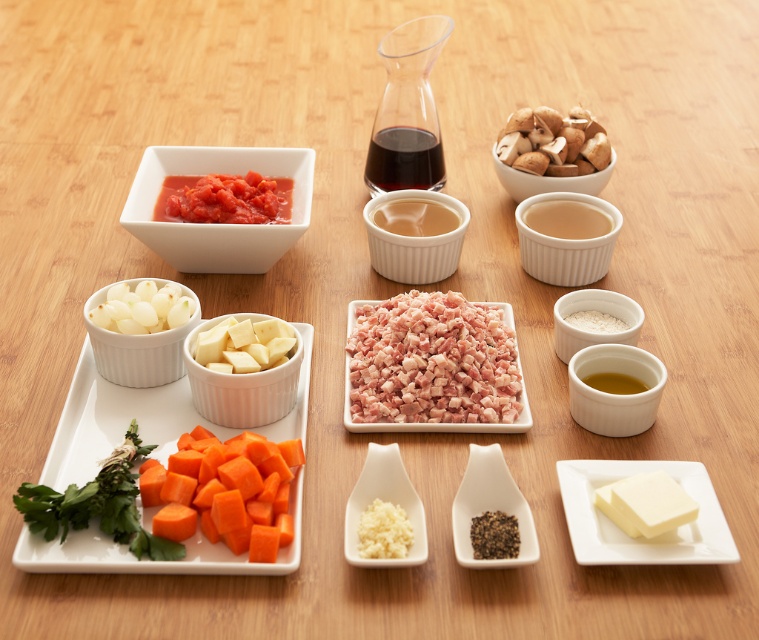
You are preparing a dish and need to locate the mushrooms and the ramekin. Based on the scene, where is the matte white ramekin at center right in relation to the brown matte mushrooms at upper right?

The matte white ramekin at center right is located below the brown matte mushrooms at upper right.

You are a chef preparing a dish and need to add the dark glossy liquid at center and the white granular garlic at center to your recipe. If you want to use the larger container first, which one should you start with?

The dark glossy liquid at center has a larger size compared to the white granular garlic at center, so you should start with the dark glossy liquid at center.